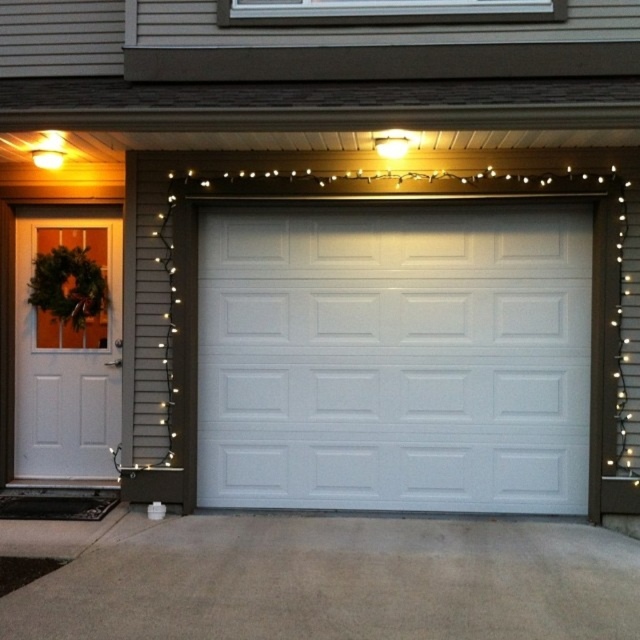
Which is more to the right, gray concrete driveway at lower center or white matte door at left?

Positioned to the right is gray concrete driveway at lower center.

Image resolution: width=640 pixels, height=640 pixels. I want to click on gray concrete driveway at lower center, so click(324, 579).

Is white painted wood garage door at center to the right of matte yellow light bulb at upper left from the viewer's perspective?

Indeed, white painted wood garage door at center is positioned on the right side of matte yellow light bulb at upper left.

Between point (340, 508) and point (60, 157), which one is positioned in front?

Point (60, 157)

The height and width of the screenshot is (640, 640). In order to click on white painted wood garage door at center in this screenshot , I will do 394,358.

Does point (48, 477) come in front of point (51, 163)?

No, (48, 477) is behind (51, 163).

Who is taller, white matte door at left or matte yellow light bulb at upper left?

Standing taller between the two is white matte door at left.

Between point (102, 454) and point (42, 148), which one is positioned behind?

Point (102, 454)

The height and width of the screenshot is (640, 640). I want to click on white matte door at left, so click(x=67, y=356).